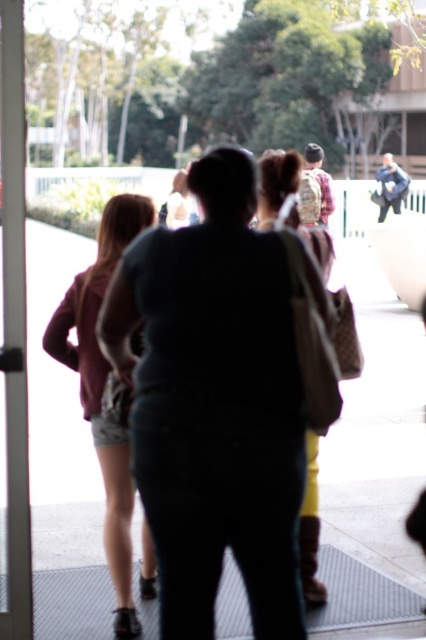
Question: Estimate the real-world distances between objects in this image. Which object is farther from the white glossy door at left?

Choices:
 (A) dark blue jeans at center
 (B) denim shorts at left

Answer: (A)

Question: Is the position of dark blue jeans at center less distant than that of white glossy door at left?

Choices:
 (A) no
 (B) yes

Answer: (B)

Question: Which object is the closest to the matte beige backpack at center?

Choices:
 (A) dark blue jeans at center
 (B) denim shorts at left
 (C) white glossy door at left

Answer: (B)

Question: Observing the image, what is the correct spatial positioning of dark blue jeans at center in reference to matte beige backpack at center?

Choices:
 (A) below
 (B) above

Answer: (A)

Question: Estimate the real-world distances between objects in this image. Which object is closer to the dark blue jeans at center?

Choices:
 (A) white glossy door at left
 (B) matte beige backpack at center

Answer: (A)

Question: Does dark blue jeans at center appear under matte beige backpack at center?

Choices:
 (A) no
 (B) yes

Answer: (B)